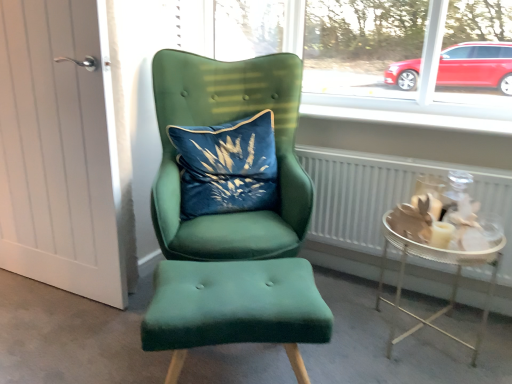
Question: Is white smooth window sill at upper center taller than velvet blue pillow at center?

Choices:
 (A) yes
 (B) no

Answer: (B)

Question: From a real-world perspective, is white smooth window sill at upper center positioned under velvet blue pillow at center based on gravity?

Choices:
 (A) yes
 (B) no

Answer: (B)

Question: Is white smooth window sill at upper center positioned far away from velvet blue pillow at center?

Choices:
 (A) yes
 (B) no

Answer: (B)

Question: Can you confirm if white smooth window sill at upper center is smaller than velvet blue pillow at center?

Choices:
 (A) yes
 (B) no

Answer: (A)

Question: Is velvet blue pillow at center located within white smooth window sill at upper center?

Choices:
 (A) yes
 (B) no

Answer: (B)

Question: From the image's perspective, is velvet green armchair at center positioned above or below metallic silver tray at lower right?

Choices:
 (A) below
 (B) above

Answer: (B)

Question: Choose the correct answer: Is velvet green armchair at center inside metallic silver tray at lower right or outside it?

Choices:
 (A) inside
 (B) outside

Answer: (B)

Question: From a real-world perspective, is velvet green armchair at center physically located above or below metallic silver tray at lower right?

Choices:
 (A) above
 (B) below

Answer: (A)

Question: Is velvet green armchair at center taller or shorter than metallic silver tray at lower right?

Choices:
 (A) short
 (B) tall

Answer: (B)

Question: Is point (471, 345) positioned closer to the camera than point (322, 190)?

Choices:
 (A) farther
 (B) closer

Answer: (B)

Question: Visually, is metallic silver tray at lower right positioned to the left or to the right of white textured radiator at lower right?

Choices:
 (A) left
 (B) right

Answer: (B)

Question: Is metallic silver tray at lower right situated inside white textured radiator at lower right or outside?

Choices:
 (A) inside
 (B) outside

Answer: (B)

Question: Is metallic silver tray at lower right in front of or behind white textured radiator at lower right in the image?

Choices:
 (A) front
 (B) behind

Answer: (A)

Question: From a real-world perspective, relative to white wood door at left, is velvet blue pillow at center vertically above or below?

Choices:
 (A) above
 (B) below

Answer: (A)

Question: From the image's perspective, is velvet blue pillow at center located above or below white wood door at left?

Choices:
 (A) below
 (B) above

Answer: (B)